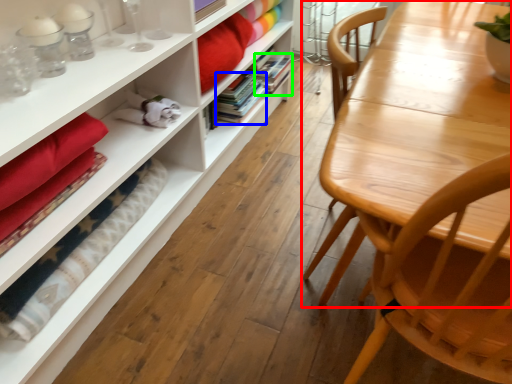
Question: Which object is the closest to the table (highlighted by a red box)? Choose among these: book (highlighted by a blue box) or book (highlighted by a green box).

Choices:
 (A) book
 (B) book

Answer: (A)